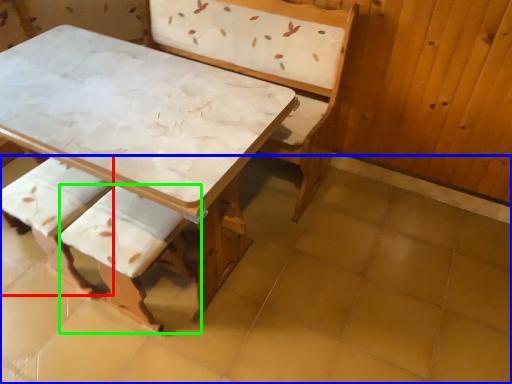
Question: Considering the real-world distances, which object is farthest from armchair (highlighted by a red box)? tile (highlighted by a blue box) or armchair (highlighted by a green box)?

Choices:
 (A) tile
 (B) armchair

Answer: (A)